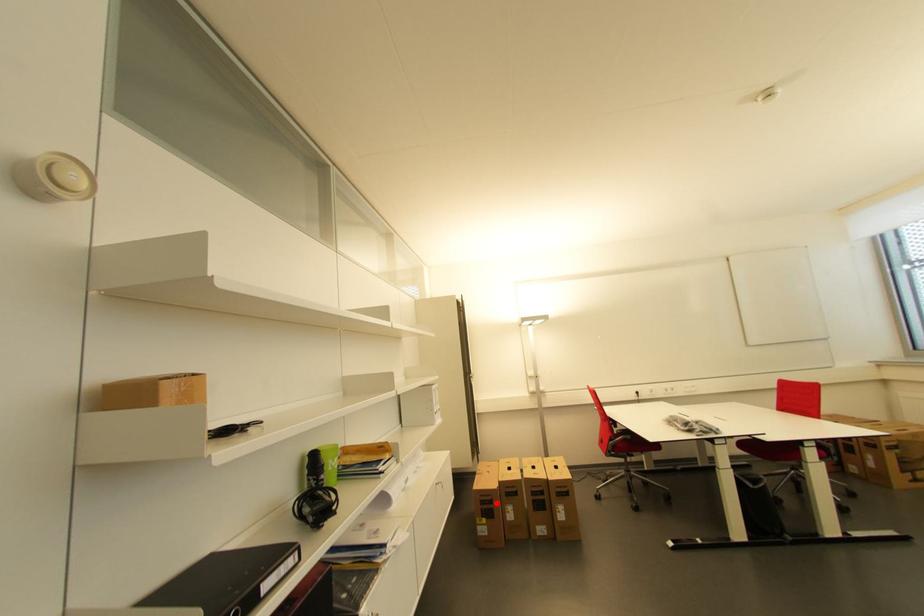
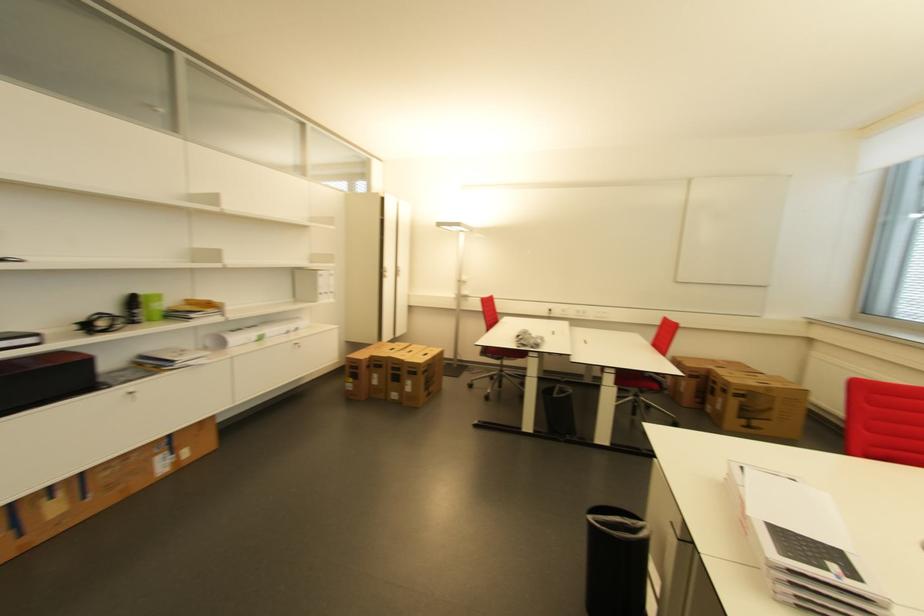
Question: I am providing you with two images of the same scene from different viewpoints. Image1 has a red point marked. In image2, the corresponding 3D location appears at what relative position? Reply with the corresponding letter.

Choices:
 (A) Closer
 (B) Farther

Answer: (A)